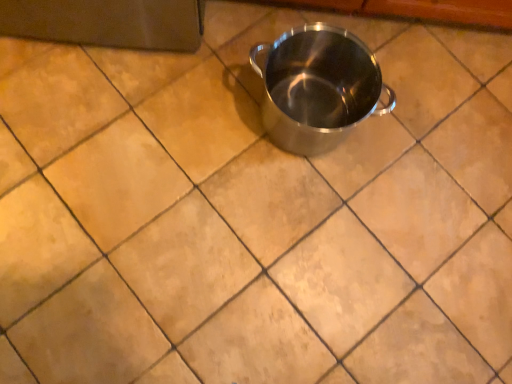
Measure the distance between point (343, 136) and camera.

They are 1.27 meters apart.

Describe the element at coordinates (317, 87) in the screenshot. I see `shiny metallic pot at center` at that location.

You are a GUI agent. You are given a task and a screenshot of the screen. Output one action in this format:
    pyautogui.click(x=<x>, y=<y>)
    Task: Click on the shiny metallic pot at center
    
    Given the screenshot: What is the action you would take?
    pyautogui.click(x=317, y=87)

Where is `shiny metallic pot at center`? shiny metallic pot at center is located at coordinates (317, 87).